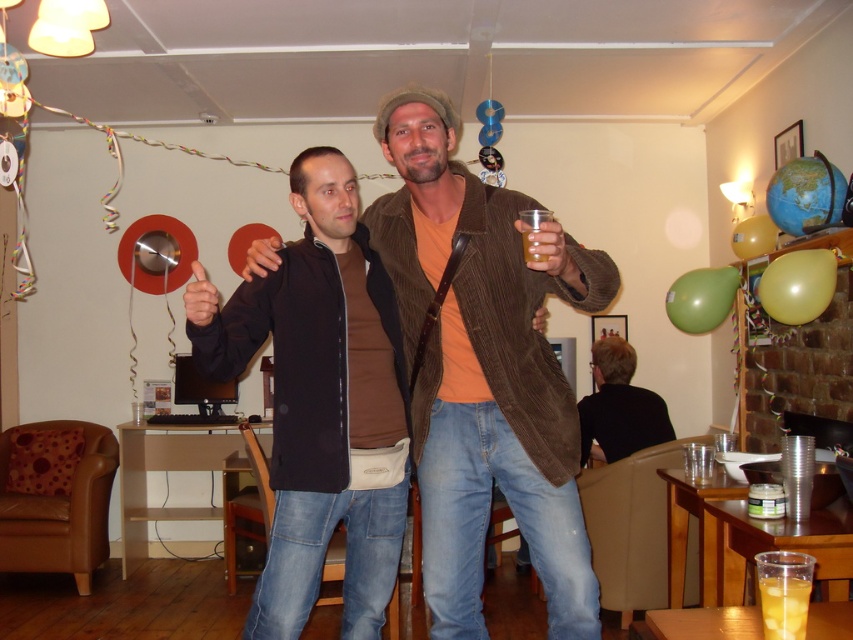
You are a photographer setting up for a group photo. You notice the matte black jacket at center and the green matte balloon at upper right. Which object should you focus on first if you want to capture the larger object in your frame?

You should focus on the matte black jacket at center first because it has a larger size compared to the green matte balloon at upper right.

You are a guest at the party and want to grab a drink. You see the green matte balloon at upper right and the translucent plastic cup at lower right. Which object is bigger?

The green matte balloon at upper right is larger in size than the translucent plastic cup at lower right.

You are at a party and want to grab a drink without moving your feet. You see the green matte balloon at upper right and the translucent plastic cup at lower right. Which one is closer to your current position?

The translucent plastic cup at lower right is closer to your current position because it is located lower than the green matte balloon at upper right, which is positioned above it.